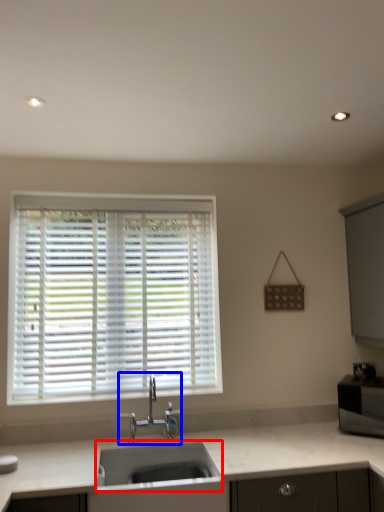
Question: Among these objects, which one is nearest to the camera, sink (highlighted by a red box) or tap (highlighted by a blue box)?

Choices:
 (A) sink
 (B) tap

Answer: (A)